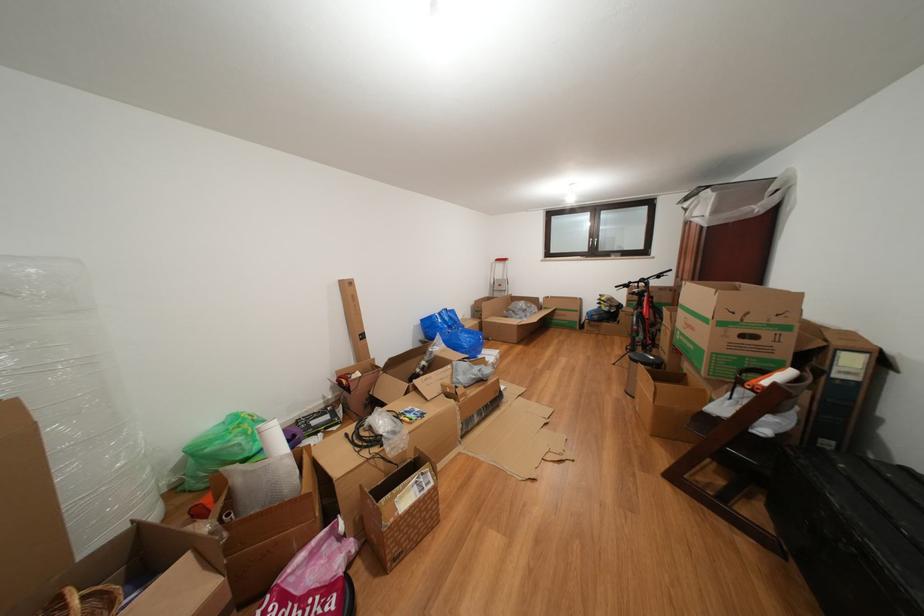
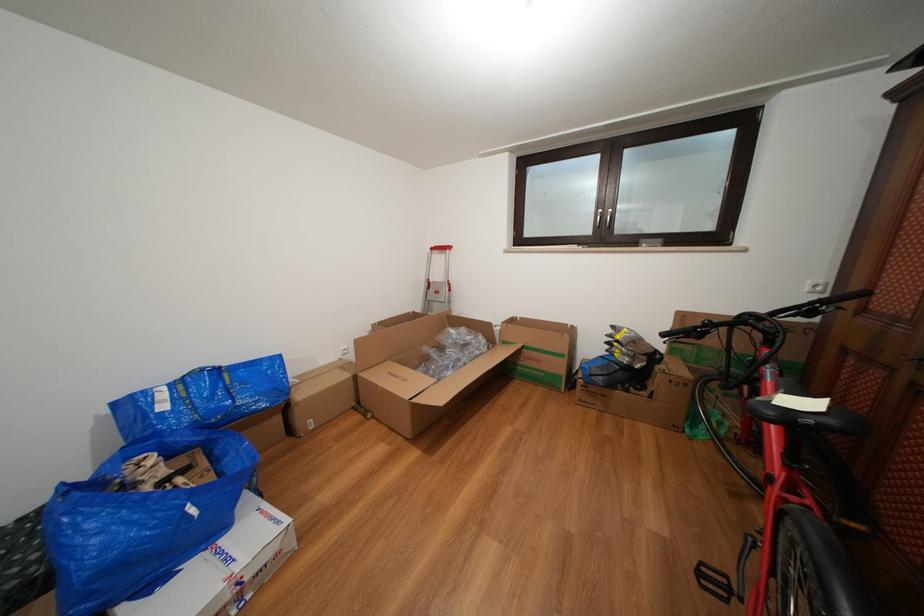
In the second image, find the point that corresponds to (x=505, y=265) in the first image.

(441, 254)